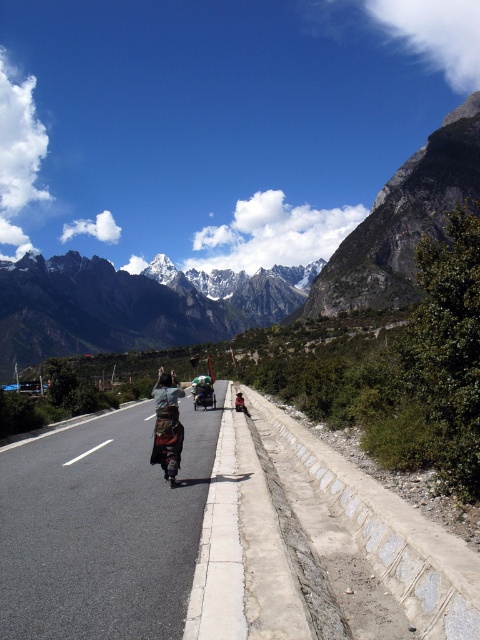
Does point (160, 392) lie behind point (202, 392)?

No, it is not.

The image size is (480, 640). What do you see at coordinates (167, 392) in the screenshot?
I see `dark gray fabric backpack at center` at bounding box center [167, 392].

Is point (164, 392) positioned before point (210, 378)?

Yes.

The width and height of the screenshot is (480, 640). Find the location of `dark gray fabric backpack at center`. dark gray fabric backpack at center is located at coordinates (167, 392).

Can you confirm if smooth concrete path at center is taller than green matte motorcycle at center?

In fact, smooth concrete path at center may be shorter than green matte motorcycle at center.

Is point (422, 637) more distant than point (194, 387)?

No, it is in front of (194, 387).

Find the location of `smooth concrete path at center`. smooth concrete path at center is located at coordinates (377, 529).

Is rugged stone mountain at upper right taller than camouflage fabric backpack at center?

Yes, rugged stone mountain at upper right is taller than camouflage fabric backpack at center.

Locate an element on the screen. The width and height of the screenshot is (480, 640). rugged stone mountain at upper right is located at coordinates (402, 221).

Is point (304, 308) more distant than point (177, 419)?

Yes, point (304, 308) is farther from viewer.

Where is `rugged stone mountain at upper right`? The width and height of the screenshot is (480, 640). rugged stone mountain at upper right is located at coordinates (402, 221).